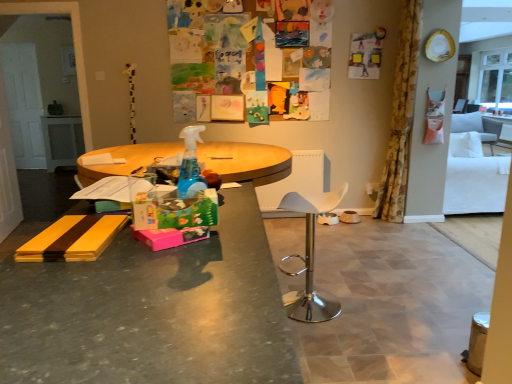
I want to click on free point in front of white plastic chair at center, so click(x=334, y=339).